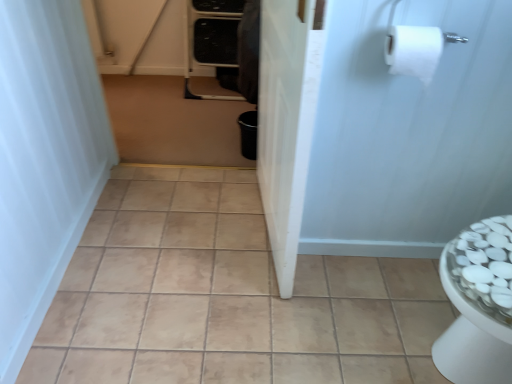
Find the location of a particular element. The width and height of the screenshot is (512, 384). vacant space that is to the left of white matte screen door at upper right, which ranks as the 2th screen door in left-to-right order is located at coordinates (293, 270).